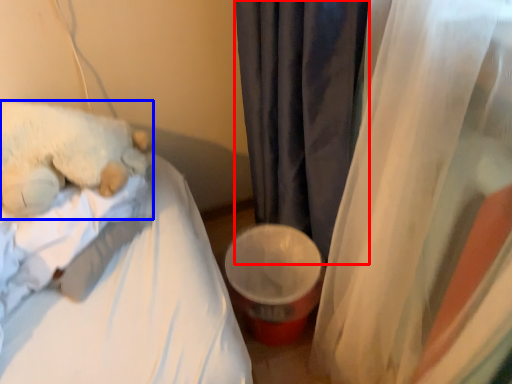
Question: Which object appears closest to the camera in this image, curtain (highlighted by a red box) or teddy bear (highlighted by a blue box)?

Choices:
 (A) curtain
 (B) teddy bear

Answer: (A)